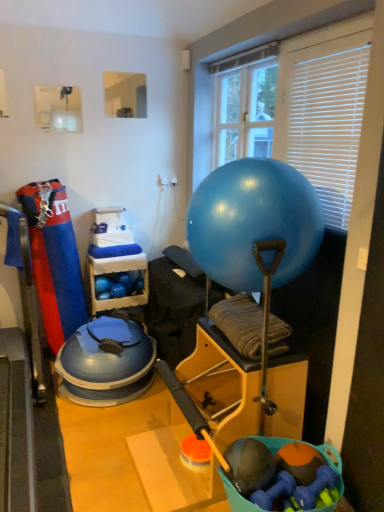
Question: From the image's perspective, is blue rubber balls at center above blue rubber ball at center?

Choices:
 (A) no
 (B) yes

Answer: (A)

Question: Does blue rubber balls at center have a lesser width compared to blue rubber ball at center?

Choices:
 (A) yes
 (B) no

Answer: (A)

Question: Is blue rubber balls at center directly adjacent to blue rubber ball at center?

Choices:
 (A) no
 (B) yes

Answer: (A)

Question: Is the position of blue rubber balls at center more distant than that of blue rubber ball at center?

Choices:
 (A) yes
 (B) no

Answer: (A)

Question: Is blue rubber ball at center completely or partially inside blue rubber balls at center?

Choices:
 (A) yes
 (B) no

Answer: (B)

Question: Based on their sizes in the image, would you say transparent plastic window screen at upper center, arranged as the second window screen when viewed from the left, is bigger or smaller than white plastic blinds at upper right?

Choices:
 (A) big
 (B) small

Answer: (A)

Question: Is transparent plastic window screen at upper center, acting as the first window screen starting from the right, to the left or to the right of white plastic blinds at upper right in the image?

Choices:
 (A) left
 (B) right

Answer: (A)

Question: From the image's perspective, is transparent plastic window screen at upper center, arranged as the second window screen when viewed from the left, located above or below white plastic blinds at upper right?

Choices:
 (A) below
 (B) above

Answer: (B)

Question: Do you think transparent plastic window screen at upper center, acting as the first window screen starting from the right, is within white plastic blinds at upper right, or outside of it?

Choices:
 (A) outside
 (B) inside

Answer: (A)

Question: Does point (112, 83) appear closer or farther from the camera than point (306, 196)?

Choices:
 (A) closer
 (B) farther

Answer: (B)

Question: Is clear glass mirror at upper center, acting as the second window screen starting from the right, wider or thinner than blue rubber ball at center?

Choices:
 (A) thin
 (B) wide

Answer: (A)

Question: Do you think clear glass mirror at upper center, the first window screen in the left-to-right sequence, is within blue rubber ball at center, or outside of it?

Choices:
 (A) outside
 (B) inside

Answer: (A)

Question: In the image, is clear glass mirror at upper center, the first window screen in the left-to-right sequence, positioned in front of or behind blue rubber ball at center?

Choices:
 (A) behind
 (B) front

Answer: (A)

Question: Considering the positions of white plastic blinds at upper right and transparent plastic window screen at upper center, acting as the first window screen starting from the right, in the image, is white plastic blinds at upper right taller or shorter than transparent plastic window screen at upper center, acting as the first window screen starting from the right,?

Choices:
 (A) short
 (B) tall

Answer: (B)

Question: Relative to transparent plastic window screen at upper center, acting as the first window screen starting from the right, is white plastic blinds at upper right in front or behind?

Choices:
 (A) front
 (B) behind

Answer: (A)